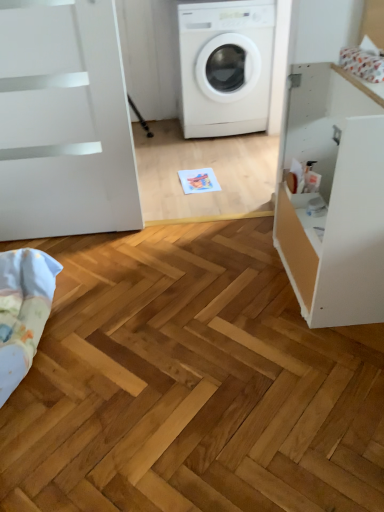
Question: Is white matte cabinet at right to the left of light blue cotton blanket at lower left from the viewer's perspective?

Choices:
 (A) yes
 (B) no

Answer: (B)

Question: Can you confirm if white matte cabinet at right is wider than light blue cotton blanket at lower left?

Choices:
 (A) no
 (B) yes

Answer: (B)

Question: Is white matte cabinet at right behind light blue cotton blanket at lower left?

Choices:
 (A) yes
 (B) no

Answer: (B)

Question: From the image's perspective, is white matte cabinet at right over light blue cotton blanket at lower left?

Choices:
 (A) no
 (B) yes

Answer: (B)

Question: Does white matte cabinet at right have a smaller size compared to light blue cotton blanket at lower left?

Choices:
 (A) yes
 (B) no

Answer: (B)

Question: Is white matte cabinet at right taller than light blue cotton blanket at lower left?

Choices:
 (A) yes
 (B) no

Answer: (A)

Question: Can you confirm if light blue cotton blanket at lower left is positioned to the left of white matte cabinet at right?

Choices:
 (A) no
 (B) yes

Answer: (B)

Question: From a real-world perspective, is light blue cotton blanket at lower left positioned under white matte cabinet at right based on gravity?

Choices:
 (A) yes
 (B) no

Answer: (A)

Question: From the image's perspective, does light blue cotton blanket at lower left appear lower than white matte cabinet at right?

Choices:
 (A) no
 (B) yes

Answer: (B)

Question: From a real-world perspective, is light blue cotton blanket at lower left on top of white matte cabinet at right?

Choices:
 (A) yes
 (B) no

Answer: (B)

Question: Is light blue cotton blanket at lower left positioned before white matte cabinet at right?

Choices:
 (A) yes
 (B) no

Answer: (B)

Question: Does light blue cotton blanket at lower left have a smaller size compared to white matte cabinet at right?

Choices:
 (A) yes
 (B) no

Answer: (A)

Question: Is light blue cotton blanket at lower left next to white matte washing machine at center?

Choices:
 (A) yes
 (B) no

Answer: (B)